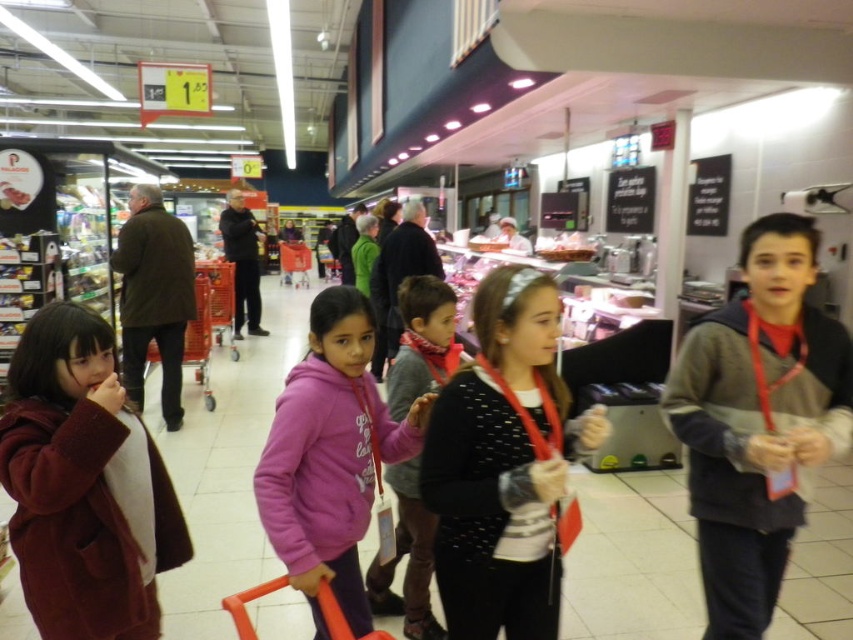
Between pink fleece hoodie at center and pink fleece jacket at center, which one has more height?

Standing taller between the two is pink fleece jacket at center.

Between pink fleece hoodie at center and pink fleece jacket at center, which one has less height?

pink fleece hoodie at center

This screenshot has width=853, height=640. What do you see at coordinates (329, 456) in the screenshot? I see `pink fleece hoodie at center` at bounding box center [329, 456].

This screenshot has height=640, width=853. I want to click on pink fleece hoodie at center, so click(x=329, y=456).

Can you confirm if maroon woolen coat at lower left is thinner than pink fleece jacket at center?

Incorrect, maroon woolen coat at lower left's width is not less than pink fleece jacket at center's.

Between maroon woolen coat at lower left and pink fleece jacket at center, which one has more height?

With more height is pink fleece jacket at center.

Describe the element at coordinates (84, 484) in the screenshot. The width and height of the screenshot is (853, 640). I see `maroon woolen coat at lower left` at that location.

Where is `maroon woolen coat at lower left`? This screenshot has height=640, width=853. maroon woolen coat at lower left is located at coordinates (84, 484).

Is matte black sweater at center bigger than pink fleece jacket at center?

Actually, matte black sweater at center might be smaller than pink fleece jacket at center.

Does matte black sweater at center have a greater width compared to pink fleece jacket at center?

Indeed, matte black sweater at center has a greater width compared to pink fleece jacket at center.

At what (x,y) coordinates should I click in order to perform the action: click on matte black sweater at center. Please return your answer as a coordinate pair (x, y). The image size is (853, 640). Looking at the image, I should click on (503, 465).